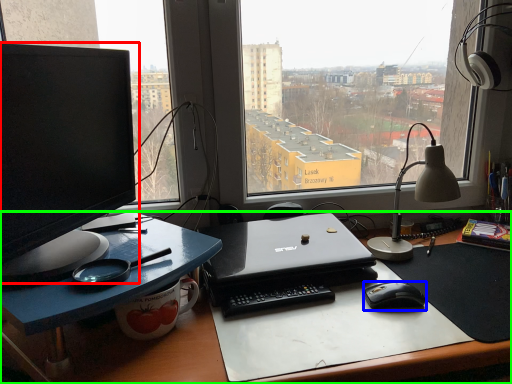
Question: Estimate the real-world distances between objects in this image. Which object is farther from computer monitor (highlighted by a red box), mouse (highlighted by a blue box) or desk (highlighted by a green box)?

Choices:
 (A) mouse
 (B) desk

Answer: (A)